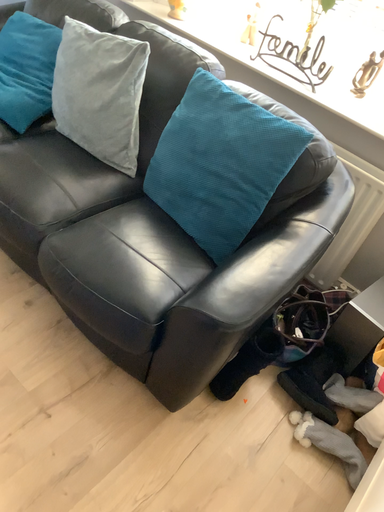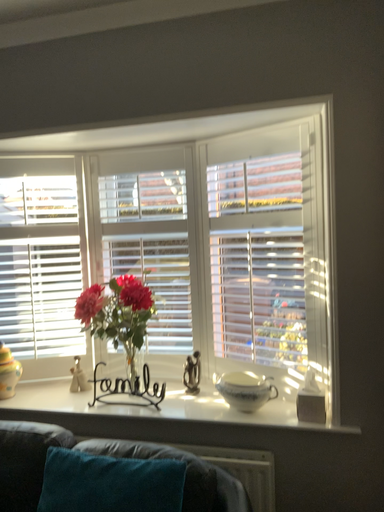
Question: How did the camera likely rotate when shooting the video?

Choices:
 (A) rotated downward
 (B) rotated upward

Answer: (B)